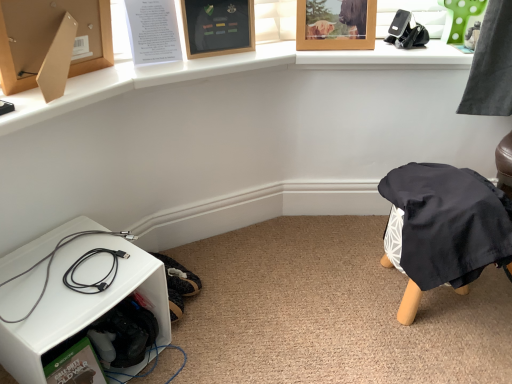
Question: Does black cable at lower left have a lesser height compared to wooden picture frame at upper center, the 2th picture frame when ordered from right to left?

Choices:
 (A) yes
 (B) no

Answer: (A)

Question: Is black cable at lower left next to wooden picture frame at upper center, the first picture frame positioned from the left, and touching it?

Choices:
 (A) no
 (B) yes

Answer: (A)

Question: From the image's perspective, is black cable at lower left under wooden picture frame at upper center, the first picture frame positioned from the left?

Choices:
 (A) no
 (B) yes

Answer: (B)

Question: Would you say black cable at lower left is a long distance from wooden picture frame at upper center, the 2th picture frame when ordered from right to left?

Choices:
 (A) no
 (B) yes

Answer: (A)

Question: Does black cable at lower left appear on the right side of wooden picture frame at upper center, the first picture frame positioned from the left?

Choices:
 (A) no
 (B) yes

Answer: (A)

Question: Based on their sizes in the image, would you say black cable at lower left is bigger or smaller than wooden picture frame at upper center, positioned as the 2th picture frame in left-to-right order?

Choices:
 (A) big
 (B) small

Answer: (B)

Question: From the image's perspective, is black cable at lower left located above or below wooden picture frame at upper center, positioned as the 2th picture frame in left-to-right order?

Choices:
 (A) above
 (B) below

Answer: (B)

Question: From a real-world perspective, is black cable at lower left above or below wooden picture frame at upper center, positioned as the 2th picture frame in left-to-right order?

Choices:
 (A) below
 (B) above

Answer: (A)

Question: Considering the positions of black cable at lower left and wooden picture frame at upper center, positioned as the 2th picture frame in left-to-right order, in the image, is black cable at lower left taller or shorter than wooden picture frame at upper center, positioned as the 2th picture frame in left-to-right order,?

Choices:
 (A) tall
 (B) short

Answer: (B)

Question: From the image's perspective, is black plastic phone holder at upper right located above or below wooden picture frame at upper center, the 2th picture frame when ordered from right to left?

Choices:
 (A) below
 (B) above

Answer: (B)

Question: From a real-world perspective, relative to wooden picture frame at upper center, the first picture frame positioned from the left, is black plastic phone holder at upper right vertically above or below?

Choices:
 (A) below
 (B) above

Answer: (A)

Question: Would you say black plastic phone holder at upper right is inside or outside wooden picture frame at upper center, the first picture frame positioned from the left?

Choices:
 (A) outside
 (B) inside

Answer: (A)

Question: Would you say black plastic phone holder at upper right is to the left or to the right of wooden picture frame at upper center, the first picture frame positioned from the left, in the picture?

Choices:
 (A) left
 (B) right

Answer: (B)

Question: Is wooden picture frame at upper center, the 2th picture frame when ordered from right to left, in front of or behind white plastic shelf at lower left in the image?

Choices:
 (A) behind
 (B) front

Answer: (A)

Question: From a real-world perspective, is wooden picture frame at upper center, the first picture frame positioned from the left, physically located above or below white plastic shelf at lower left?

Choices:
 (A) above
 (B) below

Answer: (A)